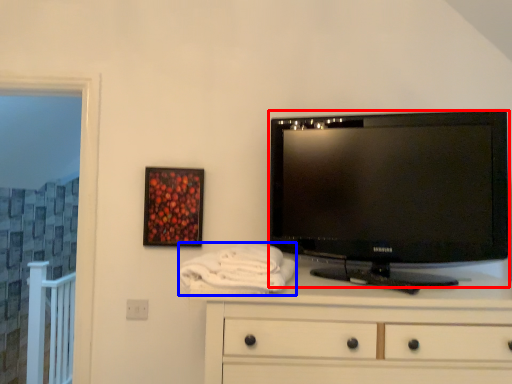
Question: Which object is further to the camera taking this photo, television (highlighted by a red box) or bath towel (highlighted by a blue box)?

Choices:
 (A) television
 (B) bath towel

Answer: (A)